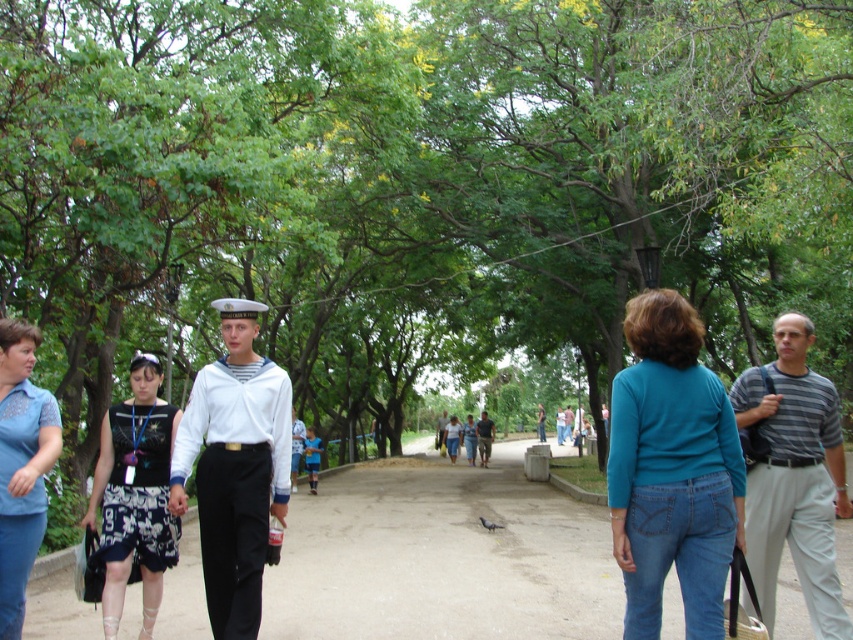
Is point (222, 333) positioned before point (444, 428)?

Yes, it is.

Which is more to the left, white matte uniform at center or denim skirt at center?

white matte uniform at center is more to the left.

Between point (225, 472) and point (457, 436), which one is positioned behind?

Positioned behind is point (457, 436).

The height and width of the screenshot is (640, 853). Identify the location of white matte uniform at center. (235, 467).

Can you confirm if white cotton sailor suit at center is positioned below white cotton shirt at center?

Actually, white cotton sailor suit at center is above white cotton shirt at center.

The height and width of the screenshot is (640, 853). Describe the element at coordinates (296, 448) in the screenshot. I see `white cotton sailor suit at center` at that location.

Measure the distance between point (293,433) and camera.

The distance of point (293,433) from camera is 65.75 feet.

I want to click on white cotton sailor suit at center, so click(x=296, y=448).

Consider the image. Does white matte uniform at center have a smaller size compared to blue denim jeans at lower left?

No.

Is point (248, 531) more distant than point (9, 424)?

Yes.

Locate an element on the screen. white matte uniform at center is located at coordinates (235, 467).

Where is `white matte uniform at center`? The width and height of the screenshot is (853, 640). white matte uniform at center is located at coordinates (235, 467).